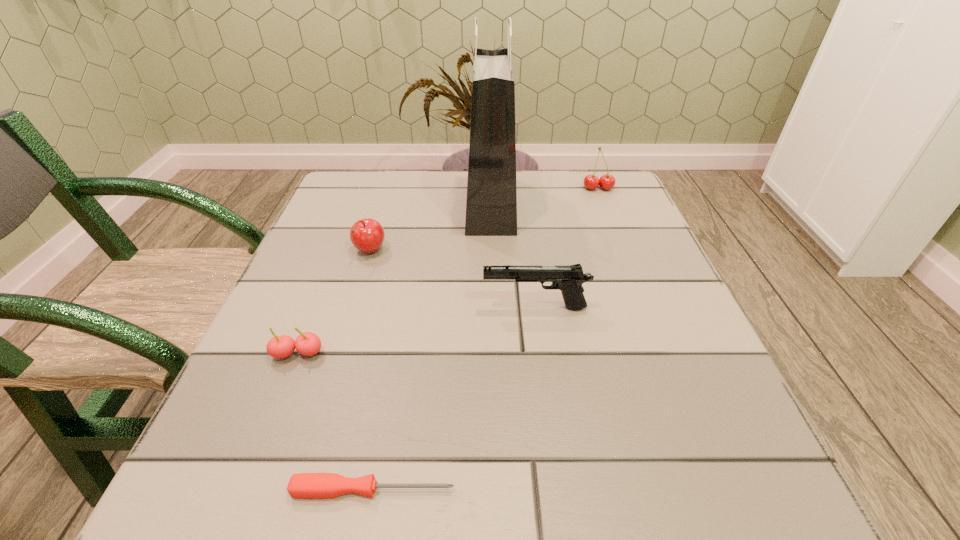
Where is `vacant area that lies between the gun and the screwdriver`? This screenshot has height=540, width=960. vacant area that lies between the gun and the screwdriver is located at coordinates (454, 399).

Where is `free spot between the farthest cherry and the fifth farthest object`? free spot between the farthest cherry and the fifth farthest object is located at coordinates (448, 271).

Find the location of a particular element. The image size is (960, 540). free space between the second shortest cherry and the third nearest object is located at coordinates (452, 280).

The height and width of the screenshot is (540, 960). Identify the location of empty space between the shortest object and the rightmost object. (486, 339).

Choose which object is the nearest neighbor to the nearest cherry. Please provide its 2D coordinates. Your answer should be formatted as a tuple, i.e. [(x, y)], where the tuple contains the x and y coordinates of a point satisfying the conditions above.

[(301, 485)]

Identify the location of object that is the fourth closest one to the nearest cherry. (491, 203).

Identify which cherry is the third closest to the shopping bag. Please provide its 2D coordinates. Your answer should be formatted as a tuple, i.e. [(x, y)], where the tuple contains the x and y coordinates of a point satisfying the conditions above.

[(307, 343)]

Image resolution: width=960 pixels, height=540 pixels. What are the coordinates of `the second closest cherry to the shortest object` in the screenshot? It's located at (367, 235).

Where is `vacant position in the image that satisfies the following two spatial constraints: 1. with the stems of the farthest cherry pointing upwards; 2. at the aiming end of the gun`? vacant position in the image that satisfies the following two spatial constraints: 1. with the stems of the farthest cherry pointing upwards; 2. at the aiming end of the gun is located at coordinates (646, 308).